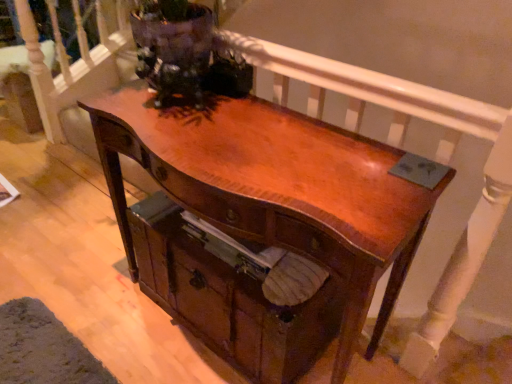
What are the coordinates of `free space to the left of shiny brown wood desk at center` in the screenshot? It's located at (91, 298).